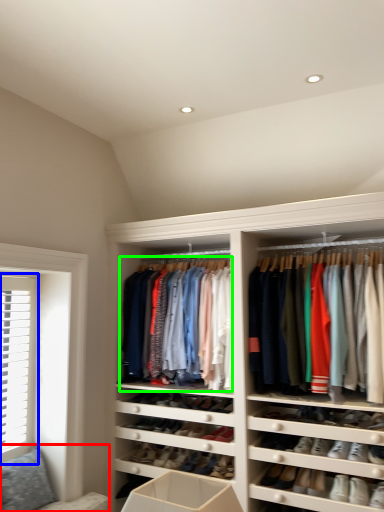
Question: Estimate the real-world distances between objects in this image. Which object is closer to couch (highlighted by a red box), window (highlighted by a blue box) or clothing (highlighted by a green box)?

Choices:
 (A) window
 (B) clothing

Answer: (A)